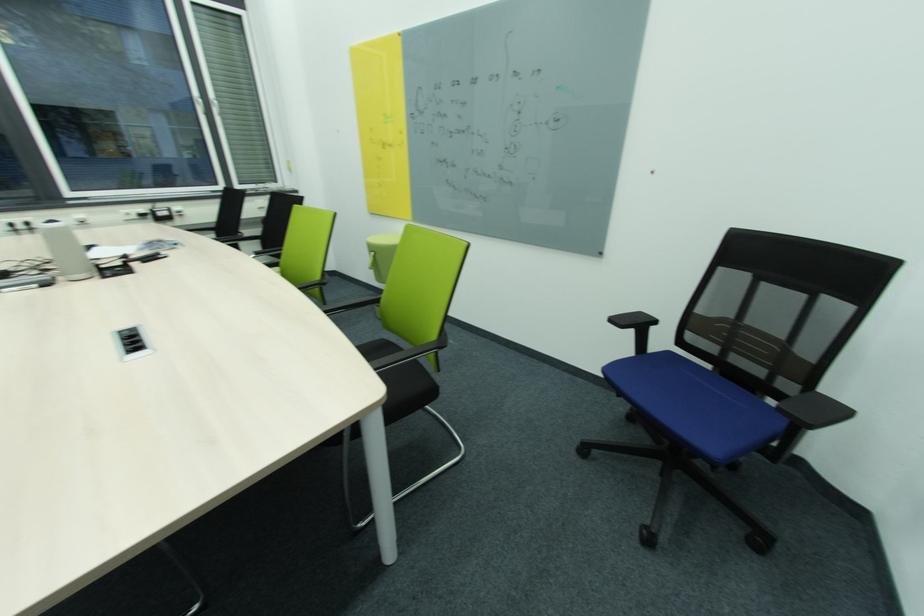
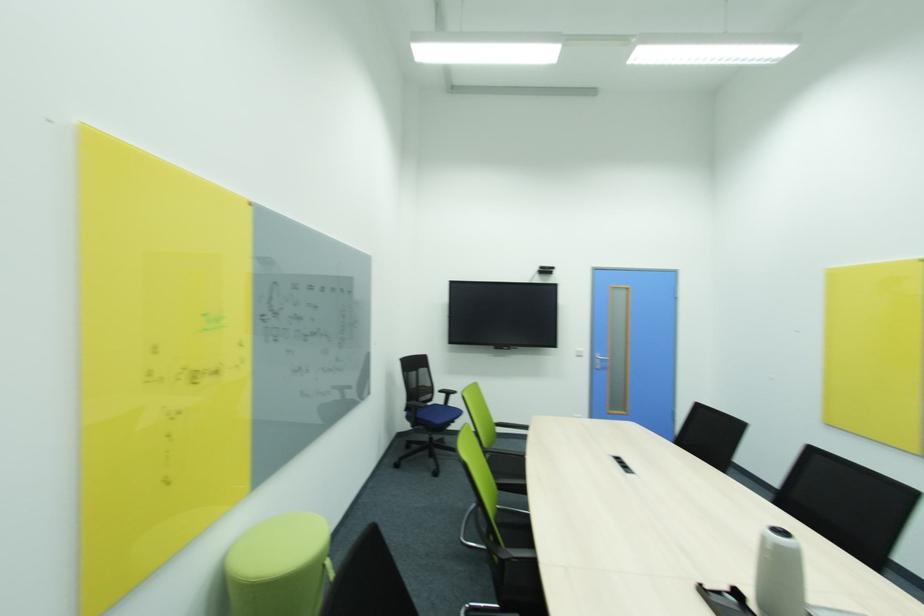
Locate, in the second image, the point that corresponds to point 837,307 in the first image.

(428, 371)